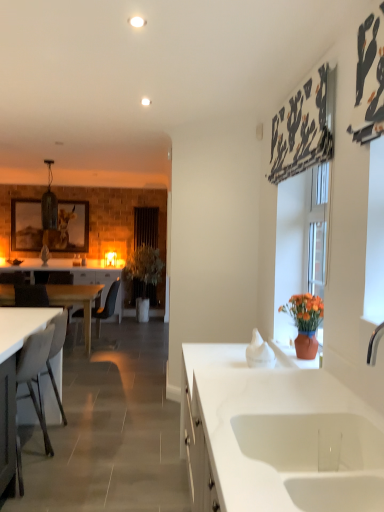
Measure the distance between white wood desk at left, which ranks as the second desk in front-to-back order, and camera.

The distance of white wood desk at left, which ranks as the second desk in front-to-back order, from camera is 5.32 meters.

This screenshot has height=512, width=384. What do you see at coordinates (31, 296) in the screenshot?
I see `white matte chair at left, which is the 2th armchair in back-to-front order` at bounding box center [31, 296].

What is the approximate width of black plastic chair at left?

black plastic chair at left is 24.70 inches in width.

Identify the location of black plastic chair at left. (106, 306).

The width and height of the screenshot is (384, 512). I want to click on white glossy countertop at lower left, so click(x=21, y=326).

Locate an element on the screen. green leafy plant at center is located at coordinates (144, 272).

Considering the points (77, 298) and (382, 507), which point is in front, point (77, 298) or point (382, 507)?

Point (382, 507)

Is white wood desk at left, placed as the 1th desk when sorted from back to front, outside of white ceramic sink at lower center?

Yes.

Is white ceramic sink at lower center at the back of white wood desk at left, placed as the 1th desk when sorted from back to front?

No, white ceramic sink at lower center is not at the back of white wood desk at left, placed as the 1th desk when sorted from back to front.

Which of these two, white wood desk at left, placed as the 1th desk when sorted from back to front, or white ceramic sink at lower center, is wider?

With larger width is white wood desk at left, placed as the 1th desk when sorted from back to front.

From the image's perspective, between white wood desk at left, positioned as the first desk in left-to-right order, and white matte chair at left, the first armchair when ordered from right to left, which one is located above?

white wood desk at left, positioned as the first desk in left-to-right order, from the image's perspective.

Which is less distant, (90, 336) or (32, 286)?

Positioned in front is point (32, 286).

Is white wood desk at left, which ranks as the second desk in front-to-back order, at the left side of white matte chair at left, which is the 1th armchair in front-to-back order?

Indeed, white wood desk at left, which ranks as the second desk in front-to-back order, is positioned on the left side of white matte chair at left, which is the 1th armchair in front-to-back order.

Would you say white wood desk at left, which ranks as the second desk in front-to-back order, contains white matte chair at left, the 2th armchair in the left-to-right sequence?

No, white matte chair at left, the 2th armchair in the left-to-right sequence, is located outside of white wood desk at left, which ranks as the second desk in front-to-back order.

Consider the image. Is wooden framed picture at left positioned before green leafy plant at center?

No, wooden framed picture at left is further to the viewer.

Considering the points (18, 237) and (133, 292), which point is in front, point (18, 237) or point (133, 292)?

Positioned in front is point (18, 237).

From the image's perspective, does wooden framed picture at left appear lower than green leafy plant at center?

No, from the image's perspective, wooden framed picture at left is not beneath green leafy plant at center.

Considering the sizes of black fabric curtain at center and black plastic chair at left in the image, is black fabric curtain at center taller or shorter than black plastic chair at left?

In the image, black fabric curtain at center appears to be taller than black plastic chair at left.

Considering the positions of points (134, 224) and (108, 298), is point (134, 224) closer to camera compared to point (108, 298)?

No, (134, 224) is behind (108, 298).

Looking at this image, from a real-world perspective, is black fabric curtain at center under black plastic chair at left?

No.

Are black fabric curtain at center and black plastic chair at left far apart?

Yes, black fabric curtain at center and black plastic chair at left are quite far apart.

Would you say brown leather armchair at left, which appears as the second armchair when viewed from the front, is to the left or to the right of white wood desk at left, which ranks as the second desk in front-to-back order, in the picture?

Based on their positions, brown leather armchair at left, which appears as the second armchair when viewed from the front, is located to the right of white wood desk at left, which ranks as the second desk in front-to-back order.

Could you tell me if brown leather armchair at left, which is the 2th armchair in right-to-left order, is turned towards white wood desk at left, which ranks as the second desk in front-to-back order?

Yes, brown leather armchair at left, which is the 2th armchair in right-to-left order, is oriented towards white wood desk at left, which ranks as the second desk in front-to-back order.

Is brown leather armchair at left, which appears as the second armchair when viewed from the front, not close to white wood desk at left, which ranks as the second desk in front-to-back order?

No.

Is brown leather armchair at left, which appears as the second armchair when viewed from the front, shorter than white wood desk at left, which ranks as the second desk in front-to-back order?

No, brown leather armchair at left, which appears as the second armchair when viewed from the front, is not shorter than white wood desk at left, which ranks as the second desk in front-to-back order.

Is green leafy plant at center looking in the opposite direction of brown leather armchair at left, the 1th armchair when ordered from left to right?

No.

From a real-world perspective, is green leafy plant at center on top of brown leather armchair at left, which appears as the 1th armchair when viewed from the back?

Correct, in the physical world, green leafy plant at center is higher than brown leather armchair at left, which appears as the 1th armchair when viewed from the back.

Does green leafy plant at center have a greater height compared to brown leather armchair at left, which appears as the second armchair when viewed from the front?

Correct, green leafy plant at center is much taller as brown leather armchair at left, which appears as the second armchair when viewed from the front.

Between point (136, 289) and point (62, 278), which one is positioned in front?

The point (62, 278) is closer.

Is point (107, 313) farther from camera compared to point (67, 330)?

Yes.

Who is smaller, black plastic chair at left or brown leather armchair at left, which is the 2th armchair in right-to-left order?

brown leather armchair at left, which is the 2th armchair in right-to-left order.

Considering the relative positions of black plastic chair at left and brown leather armchair at left, which is the 2th armchair in right-to-left order, in the image provided, is black plastic chair at left to the left of brown leather armchair at left, which is the 2th armchair in right-to-left order, from the viewer's perspective?

No, black plastic chair at left is not to the left of brown leather armchair at left, which is the 2th armchair in right-to-left order.

From a real-world perspective, which object stands above the other?

From a 3D spatial view, black plastic chair at left is above.

Locate an element on the screen. This screenshot has height=512, width=384. the 2nd desk to the left of the white ceramic sink at lower center, starting your count from the anchor is located at coordinates (76, 302).

Where is `desk directly beneath the white matte chair at left, which is the 1th armchair in front-to-back order (from a real-world perspective)`? desk directly beneath the white matte chair at left, which is the 1th armchair in front-to-back order (from a real-world perspective) is located at coordinates 76,302.

Considering their positions, is white wood desk at left, placed as the 1th desk when sorted from back to front, positioned further to white ceramic sink at lower center than wooden framed picture at left?

Among the two, wooden framed picture at left is located further to white ceramic sink at lower center.

Which object lies further to the anchor point white wood desk at left, positioned as the first desk in left-to-right order, black fabric curtain at center or white matte desk at lower left, acting as the second desk starting from the back?

The object further to white wood desk at left, positioned as the first desk in left-to-right order, is white matte desk at lower left, acting as the second desk starting from the back.

Which object lies further to the anchor point black plastic chair at left, wooden framed picture at left or green leafy plant at center?

wooden framed picture at left lies further to black plastic chair at left than the other object.

Consider the image. Considering their positions, is wooden framed picture at left positioned closer to white ceramic sink at lower center than black fabric curtain at center?

wooden framed picture at left is closer to white ceramic sink at lower center.

From the image, which object appears to be nearer to brown leather armchair at left, which appears as the 1th armchair when viewed from the back, green leafy plant at center or white ceramic sink at lower center?

green leafy plant at center is positioned closer to the anchor brown leather armchair at left, which appears as the 1th armchair when viewed from the back.

From the image, which object appears to be farther from white matte desk at lower left, placed as the 2th desk when sorted from left to right, green leafy plant at center or wooden framed picture at left?

green leafy plant at center is further to white matte desk at lower left, placed as the 2th desk when sorted from left to right.

Which object lies nearer to the anchor point black plastic chair at left, white ceramic sink at lower center or white wood desk at left, placed as the 1th desk when sorted from back to front?

white wood desk at left, placed as the 1th desk when sorted from back to front, is closer to black plastic chair at left.

When comparing their distances from green leafy plant at center, does brown leather armchair at left, the 1th armchair when ordered from left to right, or black fabric curtain at center seem further?

brown leather armchair at left, the 1th armchair when ordered from left to right, is further to green leafy plant at center.

Where is `plant between white glossy countertop at lower left and black fabric curtain at center from front to back`? This screenshot has height=512, width=384. plant between white glossy countertop at lower left and black fabric curtain at center from front to back is located at coordinates pos(144,272).

Where is `desk between white ceramic sink at lower center and white glossy countertop at lower left along the z-axis`? The height and width of the screenshot is (512, 384). desk between white ceramic sink at lower center and white glossy countertop at lower left along the z-axis is located at coordinates (14, 376).

I want to click on chair positioned between white wood desk at left, placed as the 2th desk when sorted from right to left, and wooden framed picture at left from near to far, so click(x=106, y=306).

The height and width of the screenshot is (512, 384). What are the coordinates of `chair between white matte desk at lower left, acting as the second desk starting from the back, and black fabric curtain at center from front to back` in the screenshot? It's located at (106, 306).